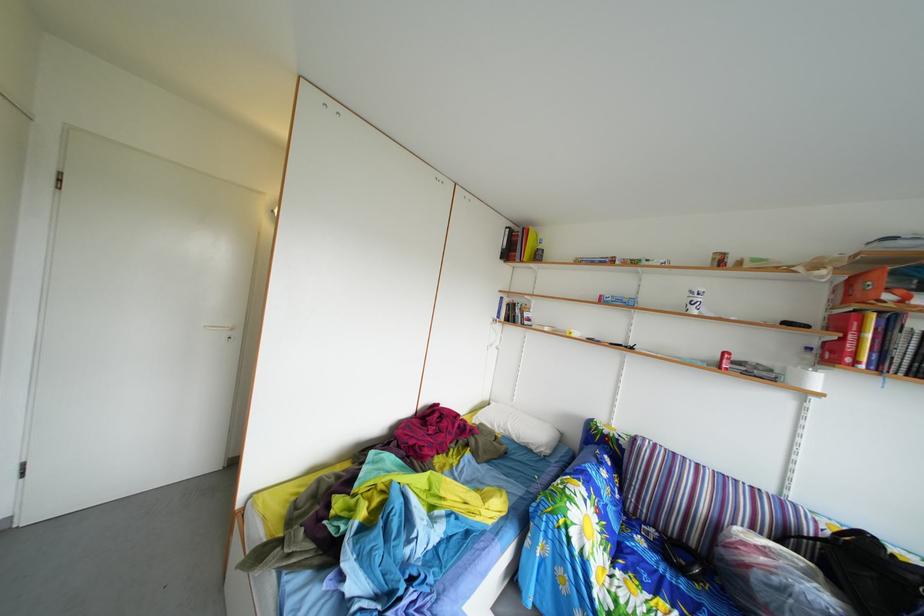
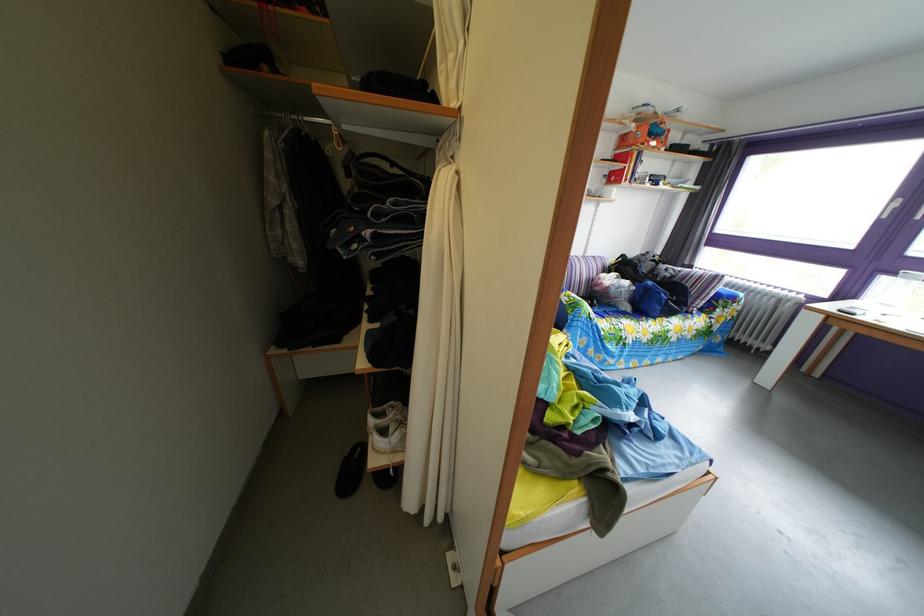
The point at (795, 495) is marked in the first image. Where is the corresponding point in the second image?

(596, 261)